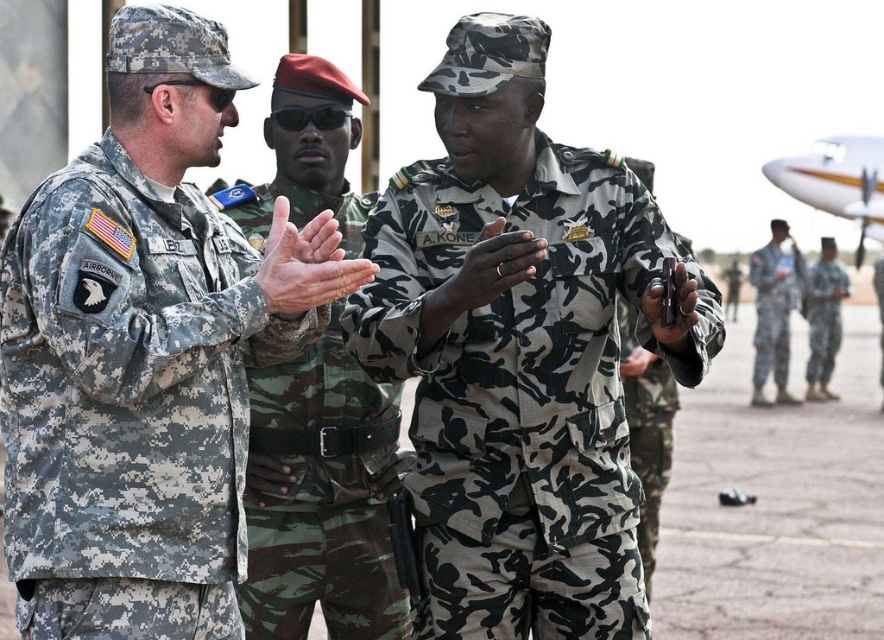
You are a military observer positioned at the scene of the image. You need to communicate with the digital camouflage uniform at left. Can you hear them if you shout normally?

The digital camouflage uniform at left and the viewer are 20.16 meters apart. Shouting normally may not be sufficient to communicate clearly at that distance.

You are a photographer at the airfield. You need to take a group photo of the digital camouflage uniform at left and the camouflage fabric uniform at right. The camera you have can only focus on objects within a 1.5 meter height range. Given their height difference, will both subjects be in focus?

The digital camouflage uniform at left is much taller than the camouflage fabric uniform at right. Since the camera can only focus on objects within a 1.5 meter height range, if the height difference between them exceeds 1.5 meters, they won

You are a photographer positioned at the edge of an airfield. You want to take a closeup photo of the camouflage fabric uniform at center. Given that your camera has a maximum zoom range of 20 meters, will you be able to capture a clear closeup?

The camouflage fabric uniform at center is 21.07 meters away from viewer. Since the camera can only zoom up to 20 meters, you won cannot capture a clear closeup.